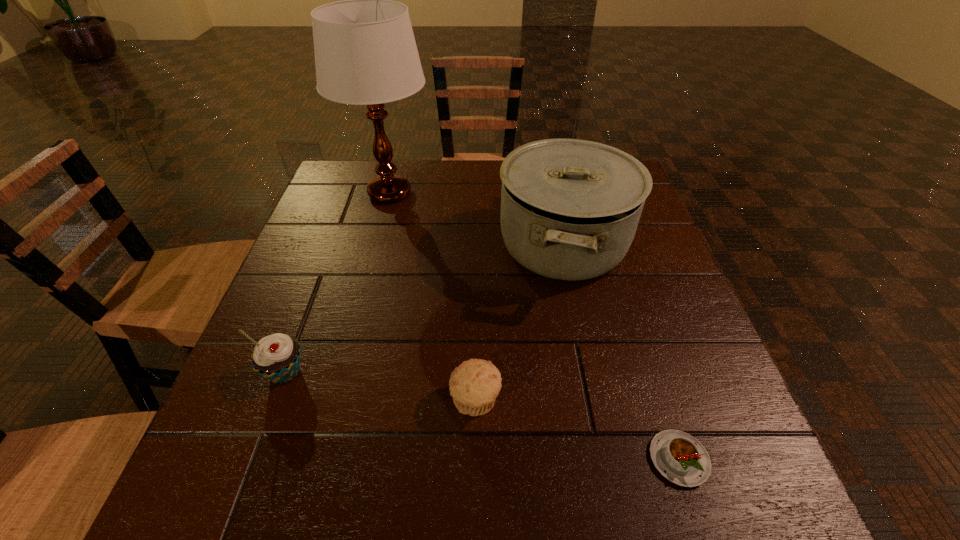
This screenshot has height=540, width=960. Find the location of `object at the far right corner`. object at the far right corner is located at coordinates (570, 208).

This screenshot has height=540, width=960. Identify the location of object present at the near right corner. (682, 459).

At what (x,y) coordinates should I click in order to perform the action: click on vacant space at the far edge of the desktop. Please return your answer as a coordinate pair (x, y). Looking at the image, I should click on (411, 202).

This screenshot has height=540, width=960. I want to click on free spot at the near edge of the desktop, so click(x=472, y=488).

Image resolution: width=960 pixels, height=540 pixels. Find the location of `free space at the left edge`. free space at the left edge is located at coordinates (225, 435).

The image size is (960, 540). In order to click on free space at the right edge of the desktop in this screenshot , I will do `click(649, 230)`.

In the image, there is a desktop. Identify the location of vacant space at the far left corner. (340, 201).

Identify the location of blank space at the near left corner. This screenshot has width=960, height=540. (233, 488).

Locate an element on the screen. This screenshot has width=960, height=540. free space between the third tallest object and the fourth shortest object is located at coordinates coord(424,309).

What are the coordinates of `free area in between the third object from right to left and the fourth shortest object` in the screenshot? It's located at (519, 323).